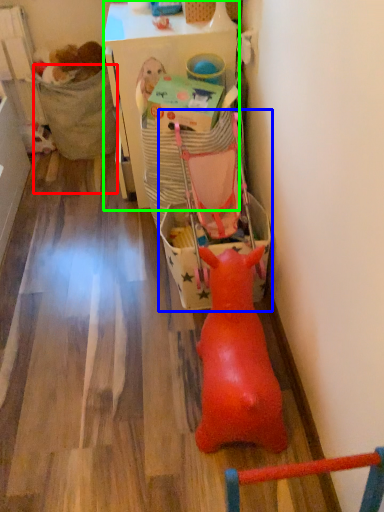
Question: Which object is positioned farthest from chair (highlighted by a red box)? Select from baby carriage (highlighted by a blue box) and table (highlighted by a green box).

Choices:
 (A) baby carriage
 (B) table

Answer: (A)